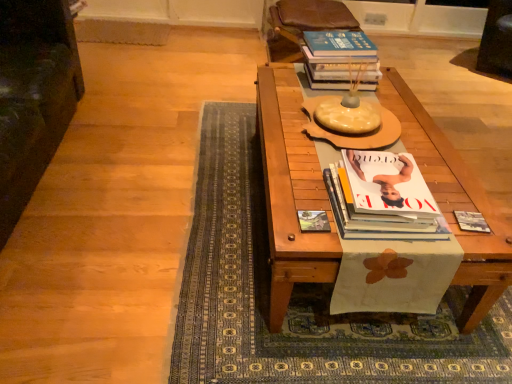
Identify the location of vacant space in front of matte black book at right, which is the 1th book in bottom-to-top order. (477, 247).